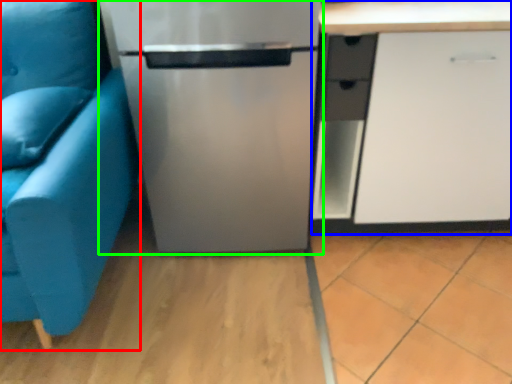
Question: Which object is the farthest from studio couch (highlighted by a red box)? Choose among these: cabinetry (highlighted by a blue box) or refrigerator (highlighted by a green box).

Choices:
 (A) cabinetry
 (B) refrigerator

Answer: (A)